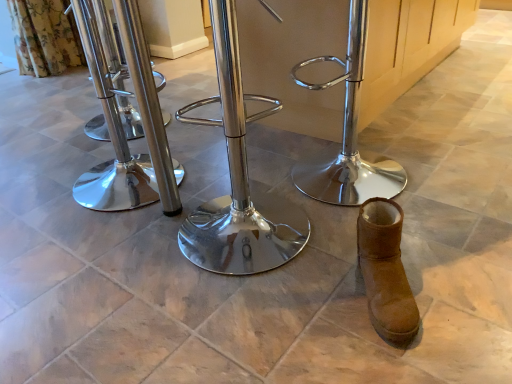
Question: Is polished metal swivel chair at center, marked as the first swivel chair in a left-to-right arrangement, in front of or behind brown suede boot at lower right in the image?

Choices:
 (A) front
 (B) behind

Answer: (B)

Question: From a real-world perspective, is polished metal swivel chair at center, marked as the first swivel chair in a left-to-right arrangement, physically located above or below brown suede boot at lower right?

Choices:
 (A) below
 (B) above

Answer: (B)

Question: Estimate the real-world distances between objects in this image. Which object is closer to the brown suede boot at lower right?

Choices:
 (A) polished metal swivel chair at center, which appears as the 2th swivel chair when viewed from the left
 (B) polished metal swivel chair at center, marked as the 3th swivel chair in a right-to-left arrangement
 (C) polished metal swivel chair at center, positioned as the 1th swivel chair in right-to-left order

Answer: (A)

Question: Estimate the real-world distances between objects in this image. Which object is farther from the polished metal swivel chair at center, marked as the 3th swivel chair in a right-to-left arrangement?

Choices:
 (A) polished metal swivel chair at center, positioned as the 1th swivel chair in right-to-left order
 (B) polished metal swivel chair at center, which appears as the 2th swivel chair when viewed from the left
 (C) brown suede boot at lower right

Answer: (C)